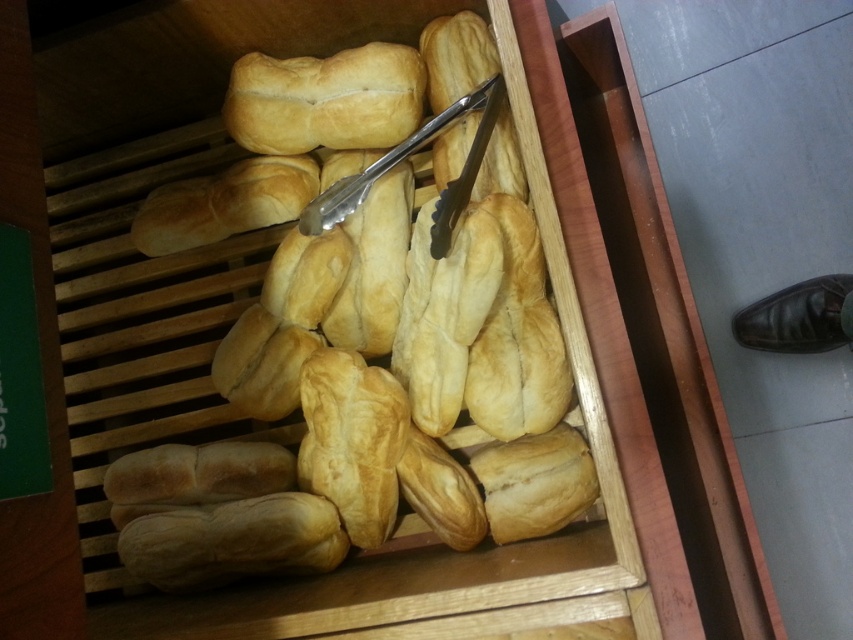
You are a baker who needs to place a new golden brown crusty loaf at center into the display case. The display case is 1 meter wide. Can the new loaf fit inside the display case?

The golden brown crusty loaf at center is 96.46 centimeters wide, which is slightly less than the 1 meter width of the display case. Therefore, the new loaf can fit inside the display case with some space remaining.